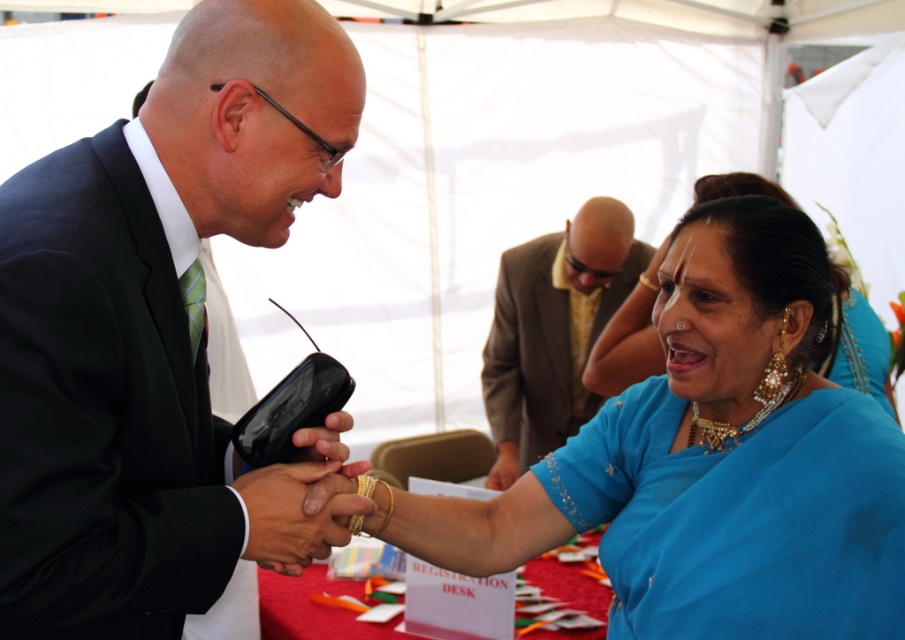
Question: Which object is the farthest from the black matte suit at center?

Choices:
 (A) brown textured suit at upper center
 (B) smooth skin hand at center
 (C) blue silk saree at lower right
 (D) blue silk saree at center

Answer: (A)

Question: Is brown textured suit at upper center thinner than blue silk saree at lower right?

Choices:
 (A) yes
 (B) no

Answer: (A)

Question: Considering the real-world distances, which object is closest to the smooth skin hand at center?

Choices:
 (A) black matte suit at center
 (B) blue silk saree at lower right
 (C) brown textured suit at upper center

Answer: (A)

Question: Which of the following is the closest to the observer?

Choices:
 (A) black matte suit at center
 (B) brown textured suit at upper center

Answer: (A)

Question: Is blue silk saree at center behind blue silk saree at lower right?

Choices:
 (A) yes
 (B) no

Answer: (B)

Question: Can you confirm if black matte suit at center is positioned to the right of blue silk saree at lower right?

Choices:
 (A) yes
 (B) no

Answer: (B)